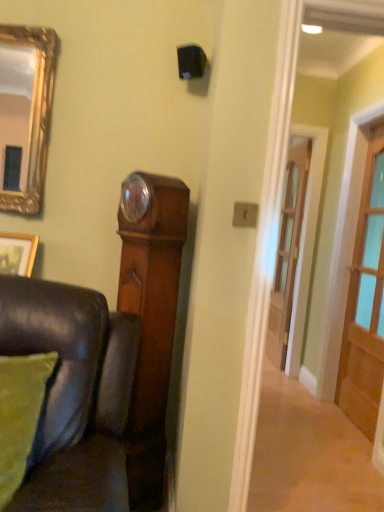
Question: Does wooden door at right, which is counted as the 2th door, starting from the left, appear on the left side of green fabric pillow at lower left?

Choices:
 (A) no
 (B) yes

Answer: (A)

Question: Is wooden door at right, the first door positioned from the front, touching green fabric pillow at lower left?

Choices:
 (A) no
 (B) yes

Answer: (A)

Question: Is wooden door at right, acting as the 2th door starting from the back, facing away from green fabric pillow at lower left?

Choices:
 (A) yes
 (B) no

Answer: (B)

Question: Is wooden door at right, acting as the 2th door starting from the back, completely or partially outside of green fabric pillow at lower left?

Choices:
 (A) no
 (B) yes

Answer: (B)

Question: From a real-world perspective, is wooden door at right, the first door positioned from the front, located beneath green fabric pillow at lower left?

Choices:
 (A) no
 (B) yes

Answer: (A)

Question: From the image's perspective, is wooden picture frame at lower left located above or below wooden door at right, marked as the first door in a right-to-left arrangement?

Choices:
 (A) above
 (B) below

Answer: (A)

Question: Visually, is wooden picture frame at lower left positioned to the left or to the right of wooden door at right, marked as the first door in a right-to-left arrangement?

Choices:
 (A) left
 (B) right

Answer: (A)

Question: In the image, is wooden picture frame at lower left positioned in front of or behind wooden door at right, which is counted as the 2th door, starting from the left?

Choices:
 (A) front
 (B) behind

Answer: (A)

Question: From a real-world perspective, relative to wooden door at right, which is counted as the 2th door, starting from the left, is wooden picture frame at lower left vertically above or below?

Choices:
 (A) below
 (B) above

Answer: (A)

Question: From a real-world perspective, relative to wooden picture frame at lower left, is green fabric pillow at lower left vertically above or below?

Choices:
 (A) above
 (B) below

Answer: (B)

Question: Is green fabric pillow at lower left spatially inside wooden picture frame at lower left, or outside of it?

Choices:
 (A) outside
 (B) inside

Answer: (A)

Question: In terms of height, does green fabric pillow at lower left look taller or shorter compared to wooden picture frame at lower left?

Choices:
 (A) short
 (B) tall

Answer: (B)

Question: In the image, is green fabric pillow at lower left positioned in front of or behind wooden picture frame at lower left?

Choices:
 (A) front
 (B) behind

Answer: (A)

Question: From a real-world perspective, is wooden door at center, the 1th door positioned from the back, positioned above or below wooden door at right, the first door positioned from the front?

Choices:
 (A) below
 (B) above

Answer: (A)

Question: Considering their positions, is wooden door at center, the 1th door positioned from the back, located in front of or behind wooden door at right, acting as the 2th door starting from the back?

Choices:
 (A) behind
 (B) front

Answer: (A)